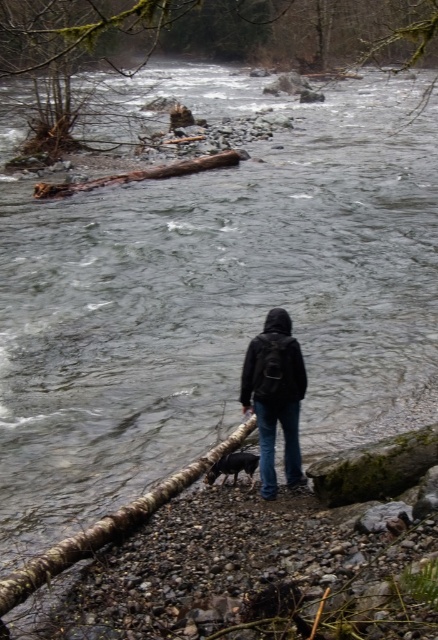
You are standing at point (279, 17). You want to cross the river to the opposite bank. The current is strong, and the fallen tree trunk is the only structure in the river. Can you safely use the fallen tree trunk to cross?

The distance between you and the fallen tree trunk is 78.50 meters. Since the river current is strong and the tree trunk is so far away, it would be unsafe to attempt to swim to it. You should look for another way to cross the river safely.

Consider the image. You are a hiker who wants to cross the river using the fallen tree trunk. You notice the green mossy branch at upper center and the brown rough log at upper center. Which object would provide a safer foothold while crossing?

The brown rough log at upper center would provide a safer foothold because its rough texture likely offers better grip compared to the green mossy branch at upper center, which is bigger but may be slippery due to moss.